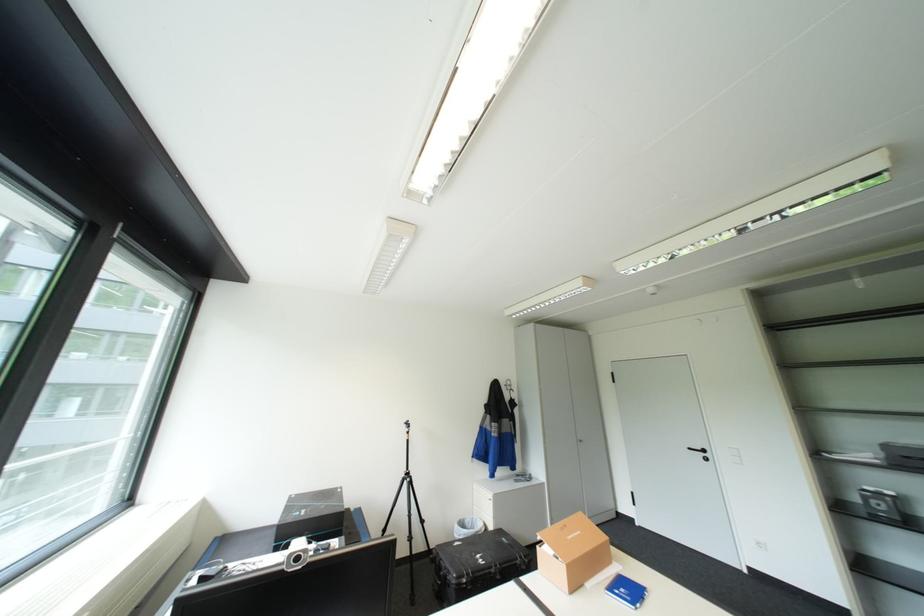
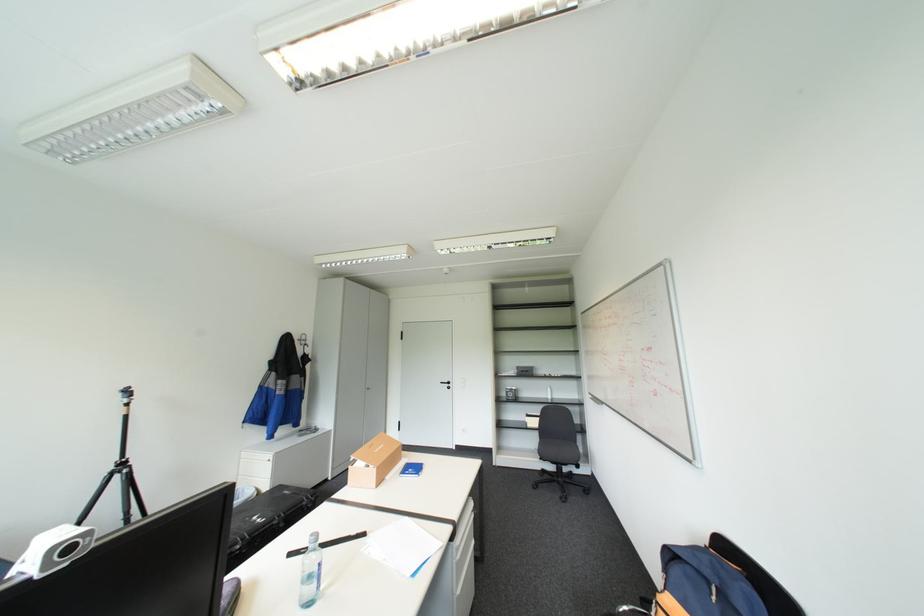
Find the pixel in the second image that matches [545,545] in the first image.

(358, 464)